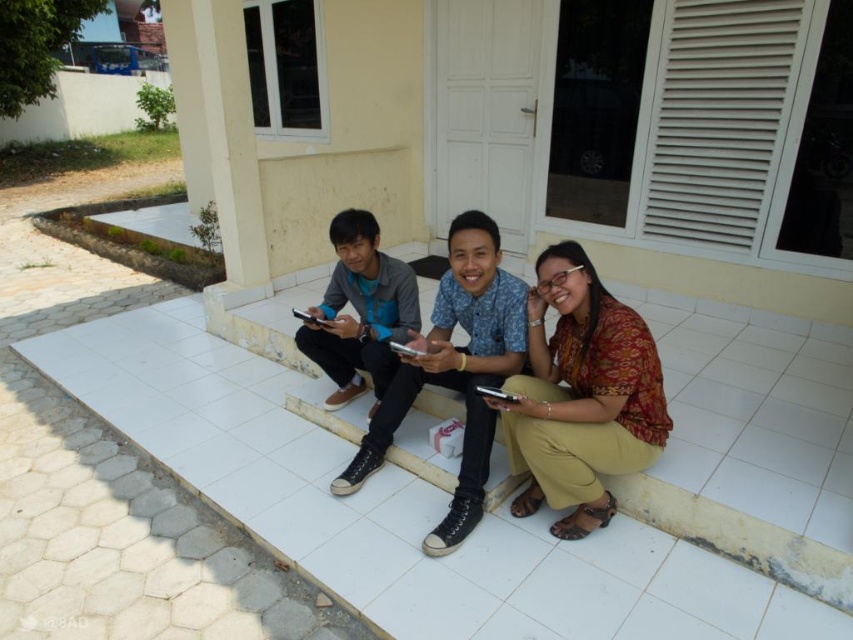
In the scene shown: You are standing on the walkway looking up at the three people sitting on the tiled step. Which object is closer to you between the printed cotton shirt at center and the matte black sneakers at center?

The printed cotton shirt at center is positioned under the matte black sneakers at center, so the matte black sneakers at center is closer to you.

You are a fashion designer observing the scene. You notice the printed cotton shirt at center and the matte gray sneakers at center. Which clothing item is positioned lower on the person?

The printed cotton shirt at center is below matte gray sneakers at center, so the printed cotton shirt at center is positioned lower on the person.

You are a shoe salesman who needs to determine the correct size for a customer. You observe two pairs of sneakers in the image, the matte black sneakers at center and the matte gray sneakers at center. Which pair would you recommend if the customer prefers a larger size?

The matte black sneakers at center has a larger size compared to the matte gray sneakers at center, so I would recommend the matte black sneakers at center for the customer who prefers a larger size.